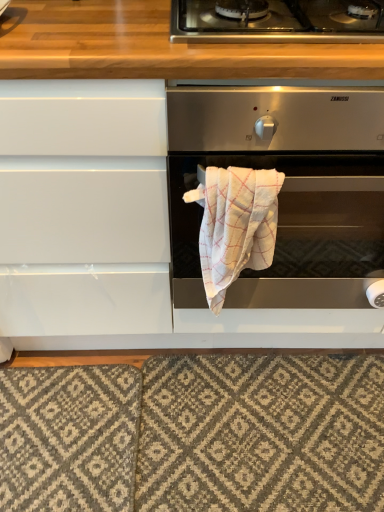
Question: Is stainless steel gas stove at upper center facing away from satin silver oven at center?

Choices:
 (A) no
 (B) yes

Answer: (A)

Question: Is stainless steel gas stove at upper center wider than satin silver oven at center?

Choices:
 (A) yes
 (B) no

Answer: (B)

Question: Is stainless steel gas stove at upper center in contact with satin silver oven at center?

Choices:
 (A) yes
 (B) no

Answer: (B)

Question: Does stainless steel gas stove at upper center have a lesser width compared to satin silver oven at center?

Choices:
 (A) yes
 (B) no

Answer: (A)

Question: From a real-world perspective, is stainless steel gas stove at upper center physically below satin silver oven at center?

Choices:
 (A) no
 (B) yes

Answer: (A)

Question: Is stainless steel gas stove at upper center further to camera compared to satin silver oven at center?

Choices:
 (A) yes
 (B) no

Answer: (A)

Question: Can you confirm if satin silver oven at center is thinner than textured gray rug at lower center?

Choices:
 (A) no
 (B) yes

Answer: (A)

Question: Is satin silver oven at center shorter than textured gray rug at lower center?

Choices:
 (A) yes
 (B) no

Answer: (B)

Question: Is satin silver oven at center positioned beyond the bounds of textured gray rug at lower center?

Choices:
 (A) yes
 (B) no

Answer: (A)

Question: From the image's perspective, does satin silver oven at center appear lower than textured gray rug at lower center?

Choices:
 (A) yes
 (B) no

Answer: (B)

Question: Can textured gray rug at lower center be found inside satin silver oven at center?

Choices:
 (A) no
 (B) yes

Answer: (A)

Question: Is satin silver oven at center facing away from textured gray rug at lower center?

Choices:
 (A) yes
 (B) no

Answer: (B)

Question: Is textured gray rug at lower center not near stainless steel gas stove at upper center?

Choices:
 (A) no
 (B) yes

Answer: (A)